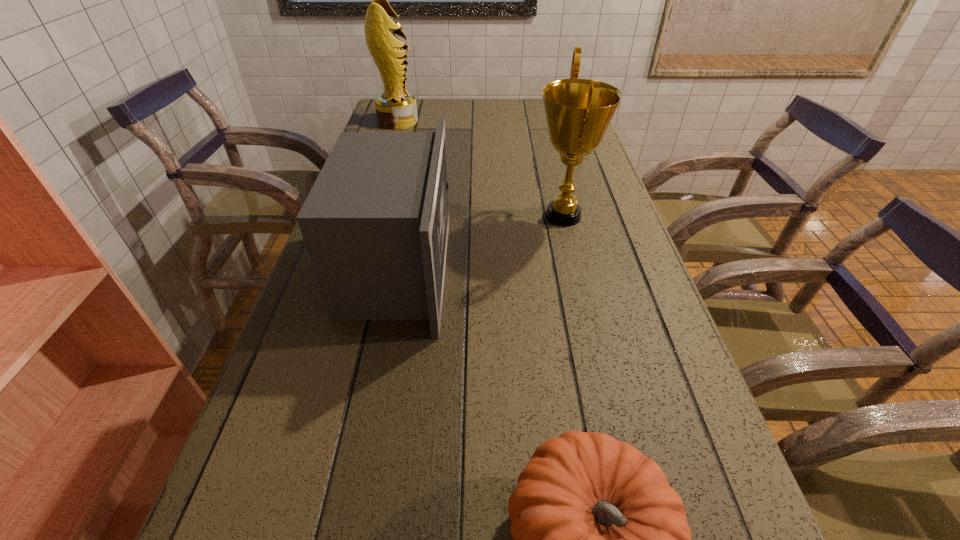
This screenshot has width=960, height=540. Find the location of `the farthest object`. the farthest object is located at coordinates (396, 108).

The image size is (960, 540). I want to click on the farther award, so click(x=396, y=108).

I want to click on the nearer award, so click(578, 111).

The image size is (960, 540). In order to click on the second shortest object in this screenshot , I will do `click(375, 224)`.

Locate an element on the screen. The image size is (960, 540). vacant space located 0.350m on the front-facing side of the farthest object is located at coordinates (514, 121).

At what (x,y) coordinates should I click in order to perform the action: click on vacant space situated 0.060m on the front view with handles of the nearer award. Please return your answer as a coordinate pair (x, y). Looking at the image, I should click on (x=508, y=216).

Where is `vacant point located 0.090m on the front view with handles of the nearer award`? vacant point located 0.090m on the front view with handles of the nearer award is located at coordinates (497, 216).

Locate an element on the screen. vacant point located 0.150m on the front view with handles of the nearer award is located at coordinates (474, 216).

Locate an element on the screen. The height and width of the screenshot is (540, 960). vacant region located 0.110m on the front-facing side of the second shortest object is located at coordinates (495, 267).

Locate an element on the screen. Image resolution: width=960 pixels, height=540 pixels. object at the far edge is located at coordinates (396, 108).